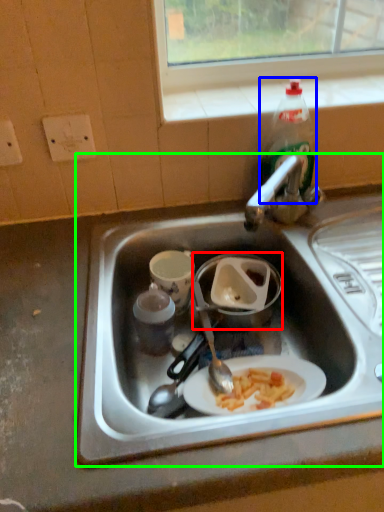
Question: Based on their relative distances, which object is nearer to appliance (highlighted by a red box)? Choose from bottle (highlighted by a blue box) and sink (highlighted by a green box).

Choices:
 (A) bottle
 (B) sink

Answer: (B)